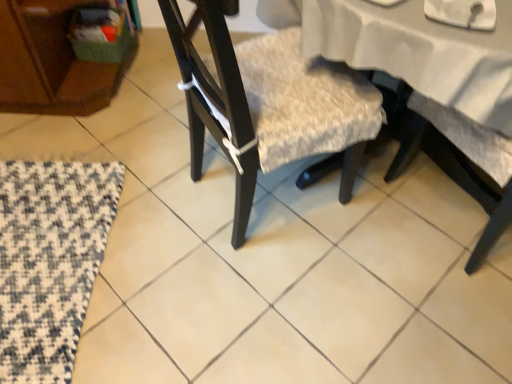
Question: Is black woven mat at lower left to the left or to the right of textured beige cushion at center in the image?

Choices:
 (A) left
 (B) right

Answer: (A)

Question: Which is correct: black woven mat at lower left is inside textured beige cushion at center, or outside of it?

Choices:
 (A) outside
 (B) inside

Answer: (A)

Question: Considering their positions, is black woven mat at lower left located in front of or behind textured beige cushion at center?

Choices:
 (A) behind
 (B) front

Answer: (A)

Question: Is point (348, 153) closer or farther from the camera than point (28, 354)?

Choices:
 (A) closer
 (B) farther

Answer: (B)

Question: From the image's perspective, relative to black woven mat at lower left, is textured beige cushion at center above or below?

Choices:
 (A) above
 (B) below

Answer: (A)

Question: Is textured beige cushion at center bigger or smaller than black woven mat at lower left?

Choices:
 (A) big
 (B) small

Answer: (A)

Question: Do you think textured beige cushion at center is within black woven mat at lower left, or outside of it?

Choices:
 (A) outside
 (B) inside

Answer: (A)